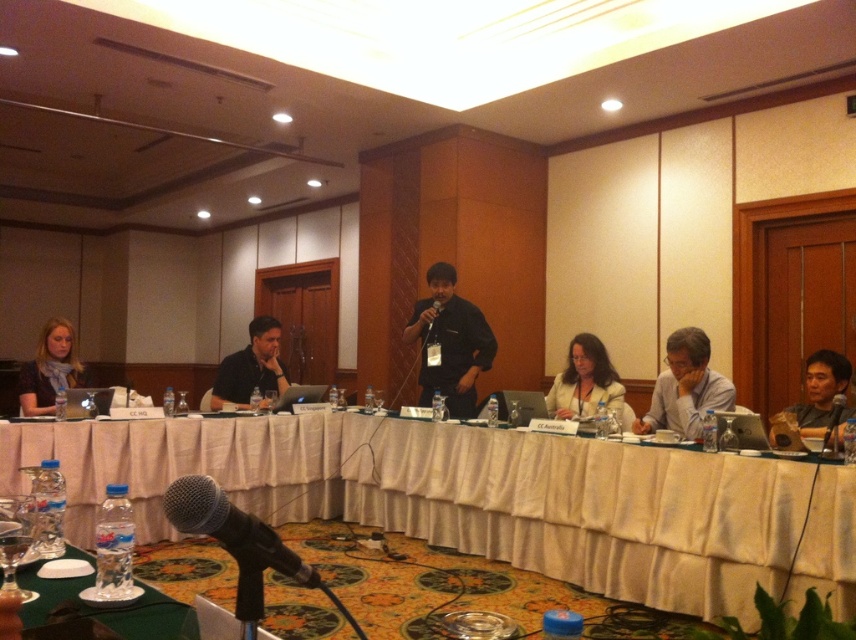
Question: Is gray fabric shirt at right bigger than black shirt at center?

Choices:
 (A) no
 (B) yes

Answer: (A)

Question: Which point appears closest to the camera in this image?

Choices:
 (A) pos(278,556)
 (B) pos(473,529)
 (C) pos(822,356)
 (D) pos(643,417)

Answer: (A)

Question: Which object is farther from the camera taking this photo?

Choices:
 (A) black matte microphone at lower right
 (B) black matte microphone at center

Answer: (B)

Question: Considering the real-world distances, which object is closest to the matte black laptop at right?

Choices:
 (A) green fabric table at center
 (B) black shirt at center
 (C) gray fabric shirt at right

Answer: (C)

Question: Can you confirm if black fabric shirt at center is bigger than matte black scarf at left?

Choices:
 (A) no
 (B) yes

Answer: (B)

Question: Considering the relative positions of green fabric table at center and gray fabric shirt at right in the image provided, where is green fabric table at center located with respect to gray fabric shirt at right?

Choices:
 (A) below
 (B) above

Answer: (A)